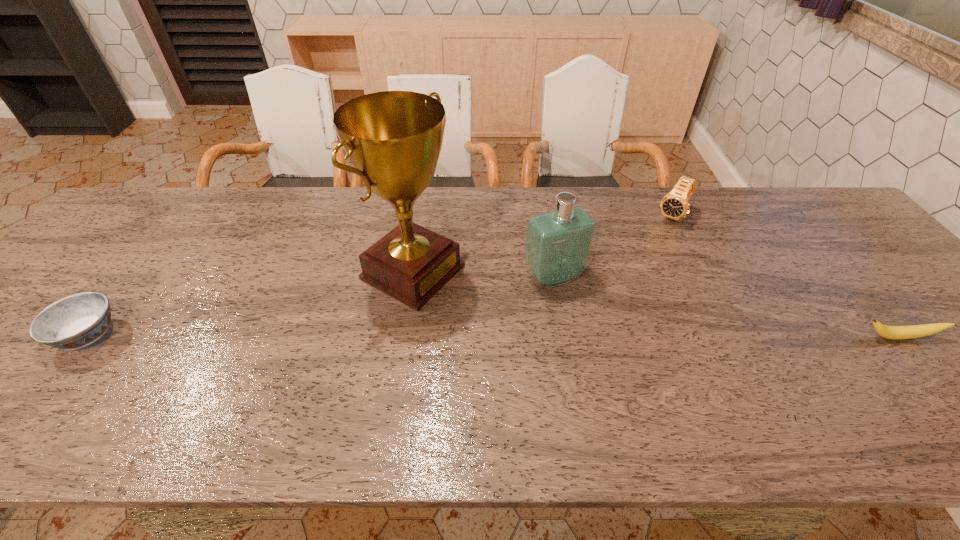
This screenshot has width=960, height=540. I want to click on vacant point located on the plaque of the award, so click(497, 316).

Image resolution: width=960 pixels, height=540 pixels. In order to click on free space located 0.320m on the plaque of the award in this screenshot , I will do `click(568, 354)`.

Find the location of `free region located on the plaque of the award`. free region located on the plaque of the award is located at coordinates (593, 367).

Where is `blank space located 0.390m on the face of the watch`? The width and height of the screenshot is (960, 540). blank space located 0.390m on the face of the watch is located at coordinates (610, 307).

Find the location of a particular element. Image resolution: width=960 pixels, height=540 pixels. free space located 0.240m on the face of the watch is located at coordinates (635, 273).

This screenshot has height=540, width=960. I want to click on vacant space located on the face of the watch, so click(648, 252).

Where is `vacant space situated 0.250m on the front label of the third object from right to left`? Image resolution: width=960 pixels, height=540 pixels. vacant space situated 0.250m on the front label of the third object from right to left is located at coordinates (622, 372).

You are a GUI agent. You are given a task and a screenshot of the screen. Output one action in this format:
    pyautogui.click(x=<x>, y=<y>)
    Task: Click on the free space located 0.240m on the front label of the third object from right to left
    Image resolution: width=960 pixels, height=540 pixels.
    Given the screenshot: What is the action you would take?
    pyautogui.click(x=619, y=368)

Identify the location of vacant space situated 0.260m on the front label of the third object from right to left. (625, 376).

The width and height of the screenshot is (960, 540). I want to click on object positioned at the far edge, so click(x=674, y=205).